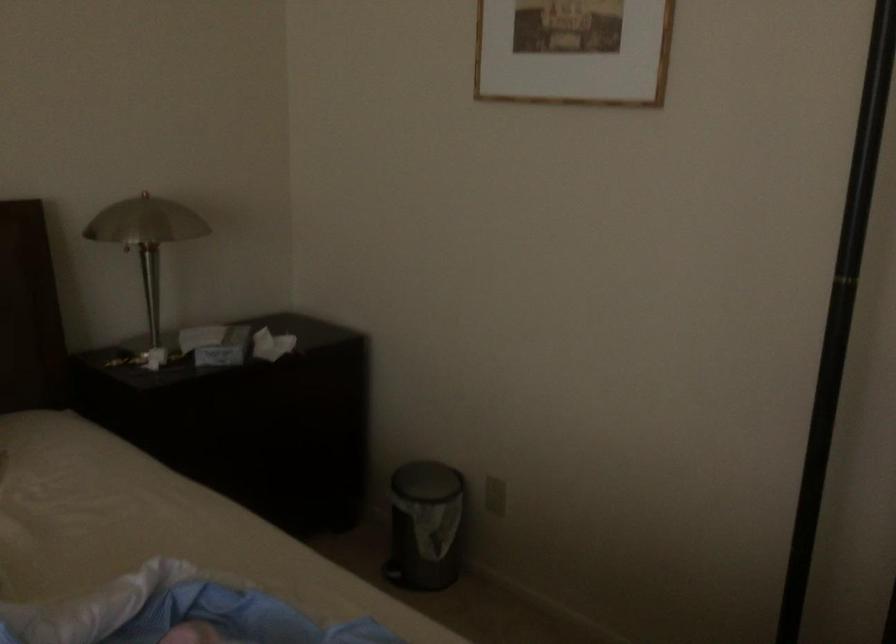
Describe the element at coordinates (392, 573) in the screenshot. The height and width of the screenshot is (644, 896). I see `a trash can pedal` at that location.